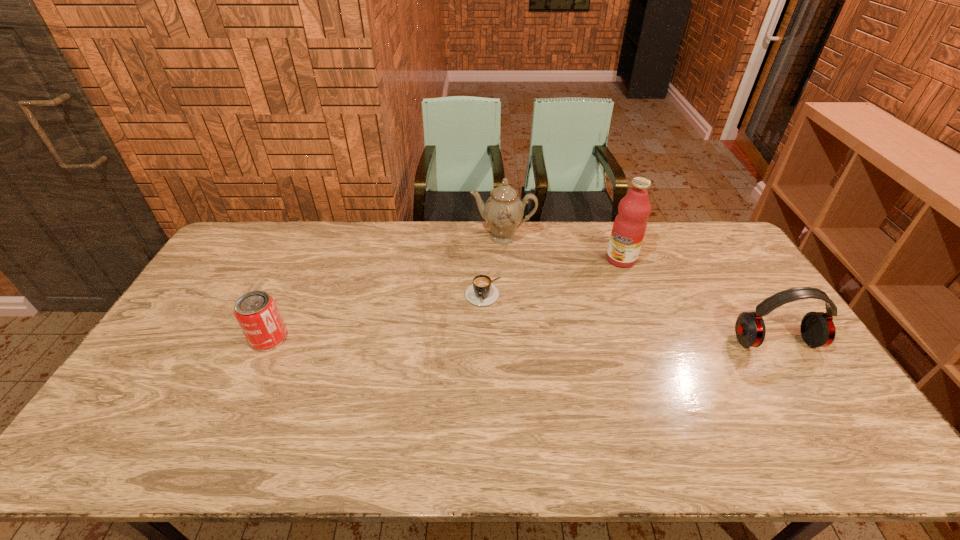
Identify the location of empty space between the fourth tallest object and the fourth object from left to right. Image resolution: width=960 pixels, height=540 pixels. (445, 299).

What are the coordinates of `empty space between the fourth object from left to right and the second shortest object` in the screenshot? It's located at (445, 299).

Where is `free spot between the rightmost object and the fourth shortest object`? This screenshot has height=540, width=960. free spot between the rightmost object and the fourth shortest object is located at coordinates (639, 289).

Where is `vacant area between the tallest object and the third farthest object`? vacant area between the tallest object and the third farthest object is located at coordinates (552, 275).

You are a GUI agent. You are given a task and a screenshot of the screen. Output one action in this format:
    pyautogui.click(x=<x>, y=<y>)
    Task: Click on the free space between the can and the third nearest object
    This screenshot has width=960, height=540.
    Given the screenshot: What is the action you would take?
    pyautogui.click(x=376, y=315)

Identify the location of vacant area that lies between the second tallest object and the fruit juice. (562, 248).

You are a GUI agent. You are given a task and a screenshot of the screen. Output one action in this format:
    pyautogui.click(x=<x>, y=<y>)
    Task: Click on the vacant area that lies between the can and the fourth object from left to right
    The height and width of the screenshot is (540, 960).
    Given the screenshot: What is the action you would take?
    pyautogui.click(x=445, y=299)

Identify the location of unoccupied area between the tallest object and the earphone. The image size is (960, 540). (698, 300).

Locate an element on the screen. This screenshot has width=960, height=540. unoccupied position between the can and the second tallest object is located at coordinates (386, 288).

This screenshot has height=540, width=960. Identify the location of object identified as the third closest to the can. (630, 224).